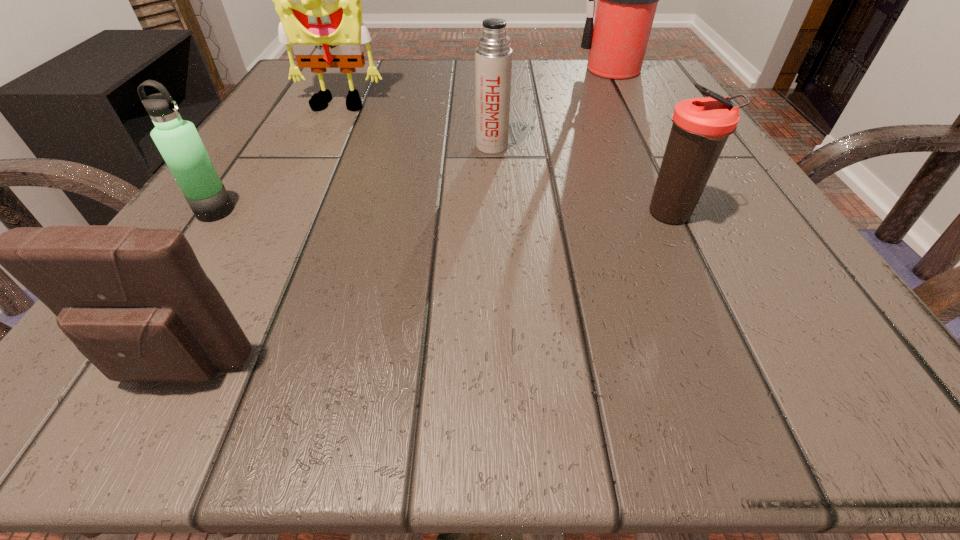
The height and width of the screenshot is (540, 960). What are the coordinates of `thermos bottle that is positioned at the left edge` in the screenshot? It's located at (178, 141).

The image size is (960, 540). Identify the location of pouch located at the left edge. (135, 302).

Where is `fire extinguisher that is positioned at the right edge`? The height and width of the screenshot is (540, 960). fire extinguisher that is positioned at the right edge is located at coordinates (627, 0).

This screenshot has height=540, width=960. Find the location of `thermos bottle present at the right edge`. thermos bottle present at the right edge is located at coordinates (701, 126).

Locate an element on the screen. object that is at the far left corner is located at coordinates (318, 0).

The width and height of the screenshot is (960, 540). Find the location of `object that is at the near left corner`. object that is at the near left corner is located at coordinates (135, 302).

You are a GUI agent. You are given a task and a screenshot of the screen. Output one action in this format:
    pyautogui.click(x=<x>, y=<y>)
    Task: Click on the object at the far right corner
    
    Given the screenshot: What is the action you would take?
    pyautogui.click(x=627, y=0)

Image resolution: width=960 pixels, height=540 pixels. Identify the location of free space at the far edge. (579, 89).

Locate an element on the screen. This screenshot has height=540, width=960. vacant space at the near edge of the desktop is located at coordinates (471, 372).

Image resolution: width=960 pixels, height=540 pixels. Find the location of `vacant region at the left edge of the desktop`. vacant region at the left edge of the desktop is located at coordinates (226, 234).